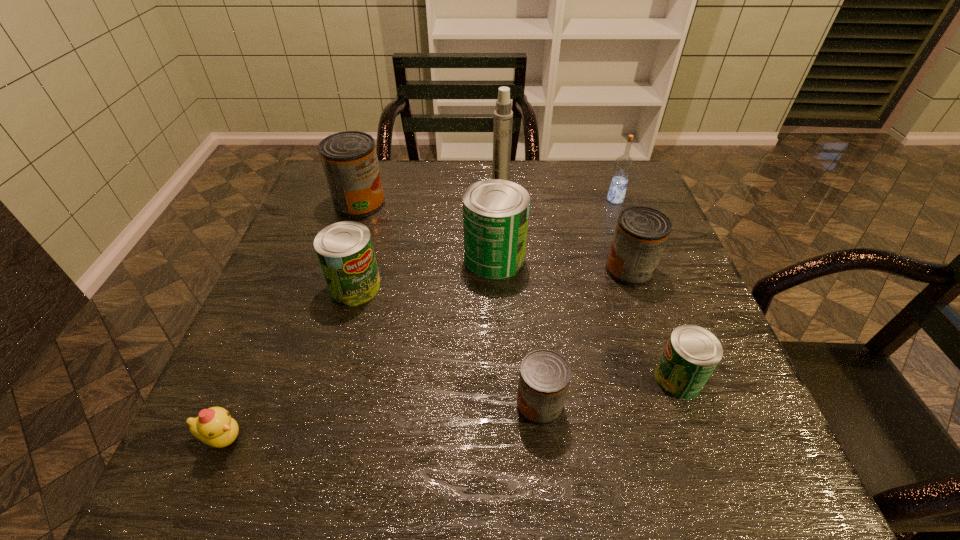
Where is `aerosol can`? aerosol can is located at coordinates (503, 115).

Where is `white aerosol can`? The width and height of the screenshot is (960, 540). white aerosol can is located at coordinates (503, 115).

The height and width of the screenshot is (540, 960). What are the coordinates of `blue vodka` in the screenshot? It's located at (623, 166).

Identify the location of the farthest red can. This screenshot has width=960, height=540. (349, 158).

Image resolution: width=960 pixels, height=540 pixels. Identify the location of the farthest can. (349, 158).

Where is `the biggest green can`? the biggest green can is located at coordinates (495, 212).

Locate an element on the screen. the second smallest red can is located at coordinates (641, 234).

Identify the location of the second farthest red can. (641, 234).

You are a GUI agent. You are given a task and a screenshot of the screen. Output one action in this format:
    pyautogui.click(x=<x>, y=<y>)
    Task: Click on the second biggest green can
    This screenshot has height=540, width=960.
    Given the screenshot: What is the action you would take?
    (344, 249)

The width and height of the screenshot is (960, 540). What are the coordinates of `the nearest green can` in the screenshot? It's located at (692, 353).